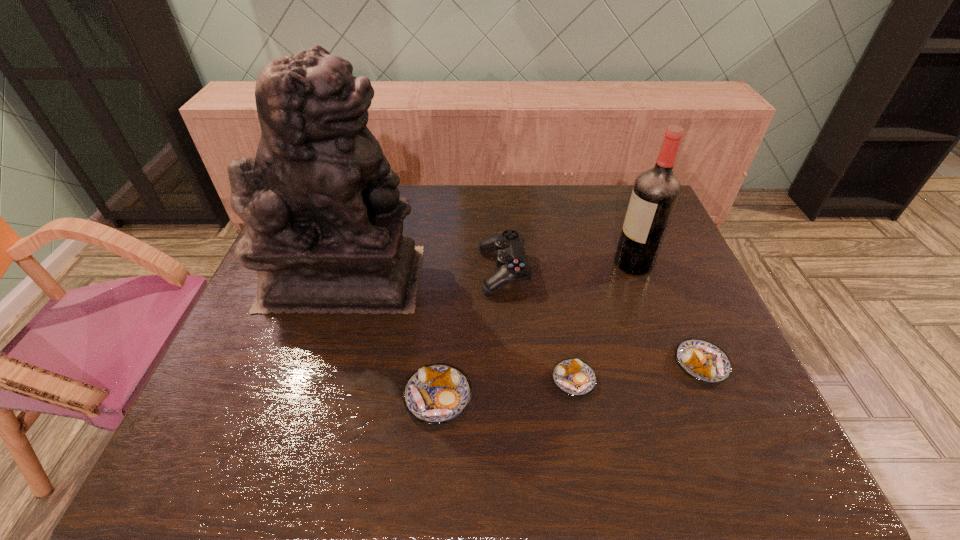
Where is `the fourth object from right to left`? The image size is (960, 540). the fourth object from right to left is located at coordinates (511, 260).

What are the coordinates of `vacant space positioned on the back of the leftmost pastry` in the screenshot? It's located at (444, 326).

Image resolution: width=960 pixels, height=540 pixels. What are the coordinates of `vacant point located 0.300m on the back of the third object from right to left` in the screenshot? It's located at (555, 274).

The width and height of the screenshot is (960, 540). What are the coordinates of `blank area located on the back of the rightmost pastry` in the screenshot? It's located at (649, 242).

Locate an element on the screen. vacant space located on the front-facing side of the leftmost object is located at coordinates (459, 278).

Locate an element on the screen. This screenshot has width=960, height=540. vacant space situated on the front-facing side of the fifth shortest object is located at coordinates (489, 264).

Locate an element on the screen. The width and height of the screenshot is (960, 540). vacant region located 0.290m on the front-facing side of the fifth shortest object is located at coordinates (516, 264).

At what (x,y) coordinates should I click in order to perform the action: click on free space located on the front-facing side of the fifth shortest object. Please return your answer as a coordinate pair (x, y). Looking at the image, I should click on pyautogui.click(x=502, y=264).

The width and height of the screenshot is (960, 540). I want to click on vacant space located 0.080m on the left of the fourth shortest object, so click(x=449, y=271).

Identify the location of object situated at the left edge. (324, 218).